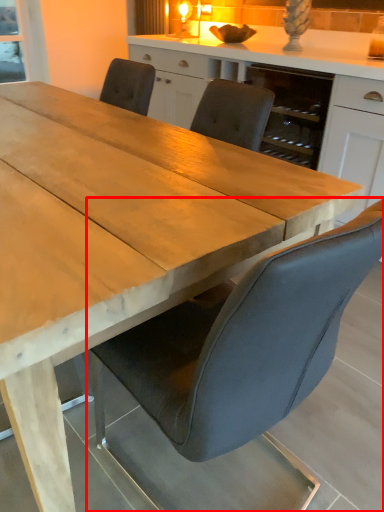
Question: From the image's perspective, what is the correct spatial positioning of chair (annotated by the red box) in reference to cabinetry?

Choices:
 (A) above
 (B) below

Answer: (B)